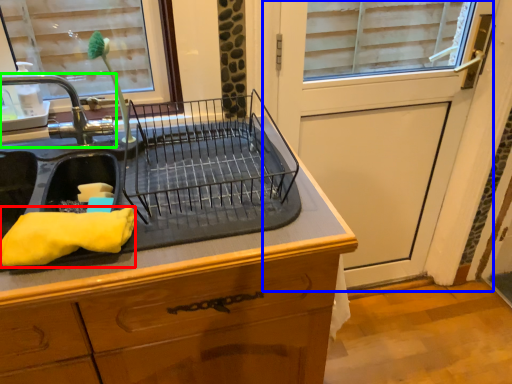
Question: Considering the real-world distances, which object is closest to material (highlighted by a red box)? screen door (highlighted by a blue box) or tap (highlighted by a green box).

Choices:
 (A) screen door
 (B) tap

Answer: (B)